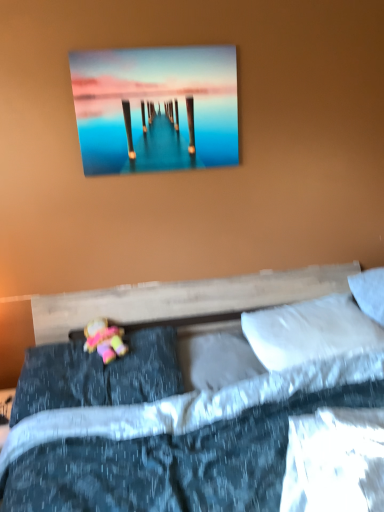
Question: From a real-world perspective, is white soft pillow at center, marked as the 3th pillow in a right-to-left arrangement, over pastel fabric doll at lower left?

Choices:
 (A) yes
 (B) no

Answer: (B)

Question: Is white soft pillow at center, which is the second pillow in left-to-right order, aimed at pastel fabric doll at lower left?

Choices:
 (A) yes
 (B) no

Answer: (B)

Question: Is white soft pillow at center, which is the second pillow in left-to-right order, to the left of pastel fabric doll at lower left from the viewer's perspective?

Choices:
 (A) no
 (B) yes

Answer: (A)

Question: Is white soft pillow at center, marked as the 3th pillow in a right-to-left arrangement, located outside pastel fabric doll at lower left?

Choices:
 (A) no
 (B) yes

Answer: (B)

Question: Is white soft pillow at center, marked as the 3th pillow in a right-to-left arrangement, wider than pastel fabric doll at lower left?

Choices:
 (A) no
 (B) yes

Answer: (B)

Question: From a real-world perspective, is white soft pillow at center, which is the second pillow in left-to-right order, positioned under pastel fabric doll at lower left based on gravity?

Choices:
 (A) yes
 (B) no

Answer: (A)

Question: Does pastel fabric doll at lower left turn towards white soft pillow at right, which ranks as the fourth pillow in left-to-right order?

Choices:
 (A) yes
 (B) no

Answer: (B)

Question: Does pastel fabric doll at lower left have a greater height compared to white soft pillow at right, which ranks as the fourth pillow in left-to-right order?

Choices:
 (A) no
 (B) yes

Answer: (A)

Question: Is white soft pillow at right, which ranks as the fourth pillow in left-to-right order, completely or partially inside pastel fabric doll at lower left?

Choices:
 (A) yes
 (B) no

Answer: (B)

Question: Is pastel fabric doll at lower left not within white soft pillow at right, marked as the 1th pillow in a right-to-left arrangement?

Choices:
 (A) yes
 (B) no

Answer: (A)

Question: Does pastel fabric doll at lower left touch white soft pillow at right, marked as the 1th pillow in a right-to-left arrangement?

Choices:
 (A) no
 (B) yes

Answer: (A)

Question: Can you confirm if pastel fabric doll at lower left is smaller than white soft pillow at right, which ranks as the fourth pillow in left-to-right order?

Choices:
 (A) no
 (B) yes

Answer: (B)

Question: Is metallic glossy pier at upper center to the left of dark blue textured pillow at lower left, the 1th pillow in the left-to-right sequence, from the viewer's perspective?

Choices:
 (A) yes
 (B) no

Answer: (B)